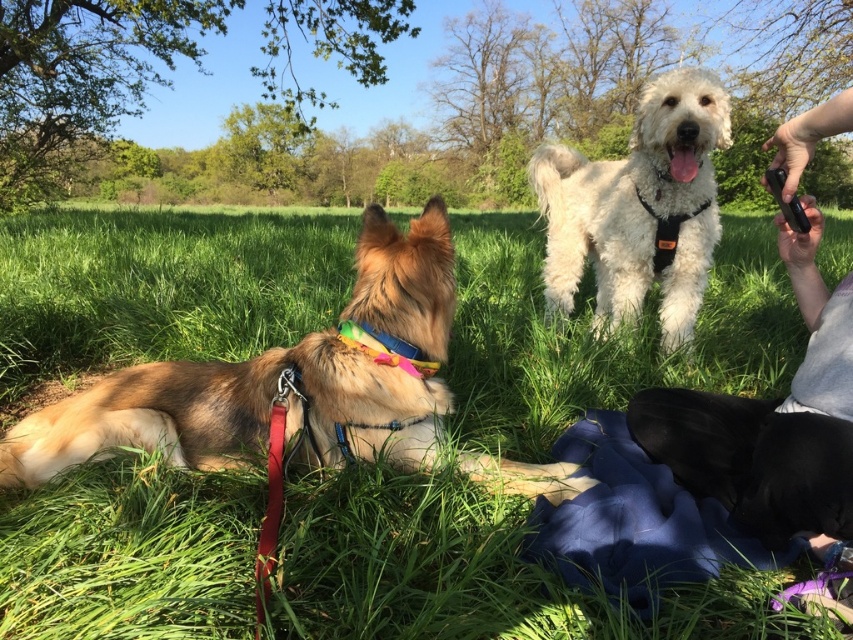
Question: Estimate the real-world distances between objects in this image. Which object is closer to the golden fur dog at left?

Choices:
 (A) white fluffy dog at upper center
 (B) green grass at center

Answer: (B)

Question: In this image, where is golden fur dog at left located relative to white fluffy dog at upper center?

Choices:
 (A) right
 (B) left

Answer: (B)

Question: Is golden fur dog at left to the left of white fluffy dog at upper center from the viewer's perspective?

Choices:
 (A) yes
 (B) no

Answer: (A)

Question: Which point is closer to the camera taking this photo?

Choices:
 (A) (108, 435)
 (B) (633, 371)

Answer: (A)

Question: Which point is farther from the camera taking this photo?

Choices:
 (A) (552, 234)
 (B) (387, 288)

Answer: (A)

Question: Does golden fur dog at left appear over white fluffy dog at upper center?

Choices:
 (A) yes
 (B) no

Answer: (B)